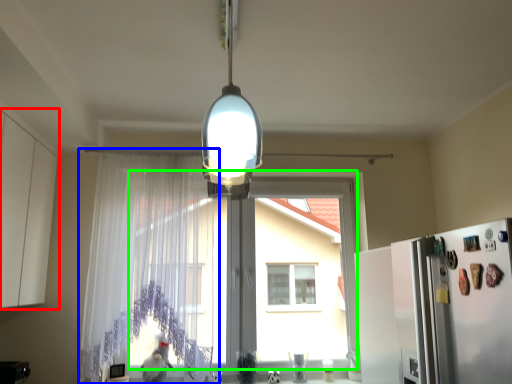
Question: Estimate the real-world distances between objects in this image. Which object is farther from cabinetry (highlighted by a red box), curtain (highlighted by a blue box) or window screen (highlighted by a green box)?

Choices:
 (A) curtain
 (B) window screen

Answer: (B)